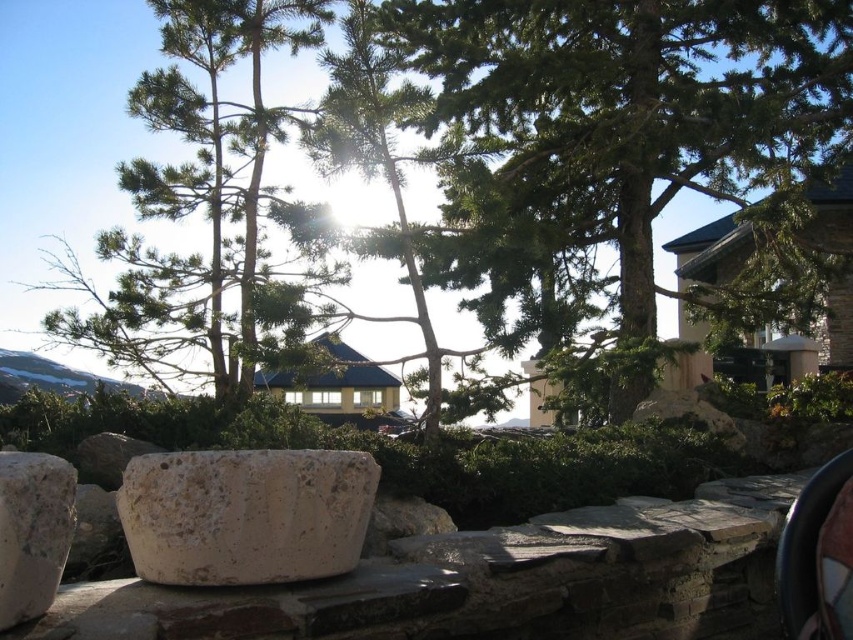
You are a landscape architect designing a garden pathway. You have to place a small statue between the white stone boulder at center and the granite boulder at lower left. Which boulder should the statue be closer to if you want it to be closer to the taller one?

The statue should be placed closer to the granite boulder at lower left because it is taller than the white stone boulder at center.

You are standing in the outdoor scene and want to take a photo of the green leafy tree at upper left and the granite boulder at lower left. Which object should you position to your left side to frame them properly?

You should position the green leafy tree at upper left to your left side because it is located to the left of the granite boulder at lower left in the scene.